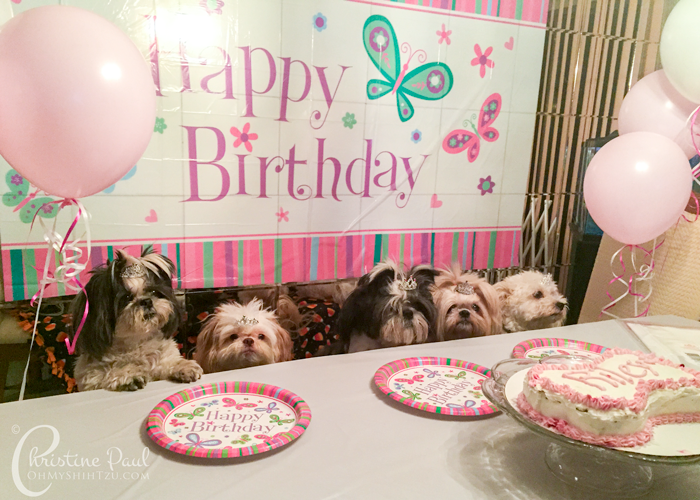
At what (x,y) coordinates should I click in order to perform the action: click on "happy birthday" written in lavender colored letters on white plate. Please return your answer as a coordinate pair (x, y). The width and height of the screenshot is (700, 500). Looking at the image, I should click on (225, 415).